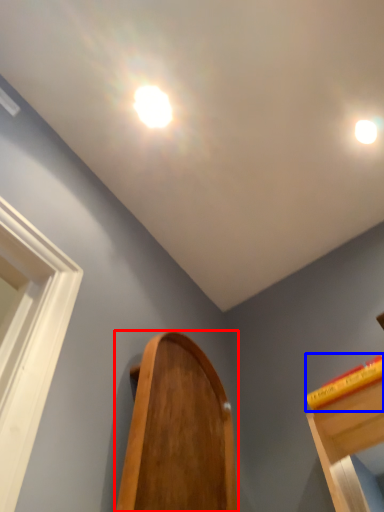
Question: Which object appears closest to the camera in this image, furniture (highlighted by a red box) or book (highlighted by a blue box)?

Choices:
 (A) furniture
 (B) book

Answer: (A)